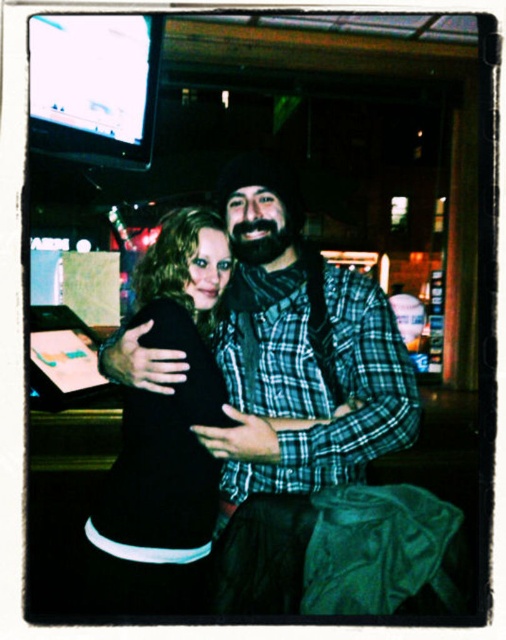
Does plaid flannel shirt at center have a lesser width compared to black matte dress at center?

No.

Which is more to the left, plaid flannel shirt at center or black matte dress at center?

Positioned to the left is black matte dress at center.

This screenshot has height=640, width=506. I want to click on plaid flannel shirt at center, so 293,388.